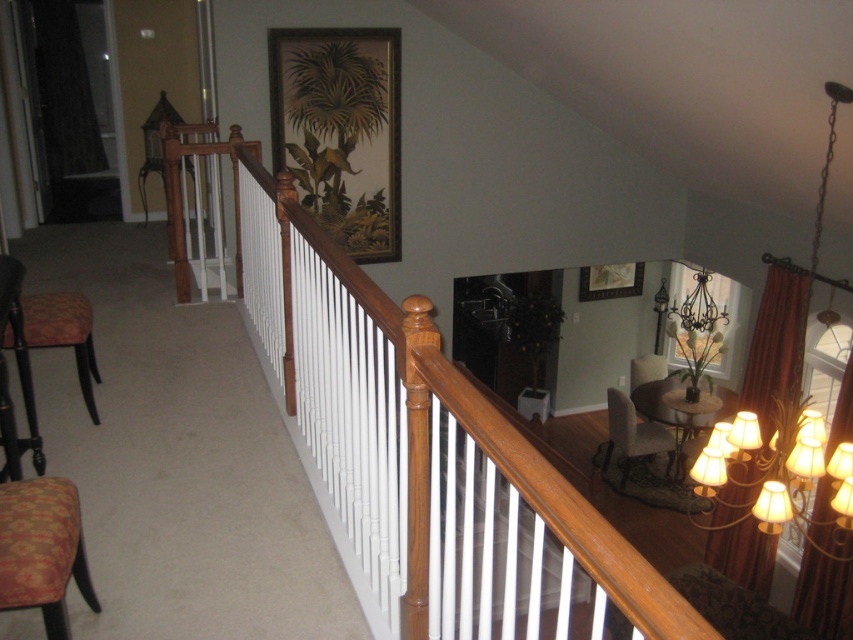
You are standing in the hallway and want to reach the dining room. You see the wooden rail at upper left. Based on its position, which direction should you turn to enter the dining room?

Since the wooden rail at upper left is located at coordinates approximately 0.702 on the x and 0.491 on the y axis, it suggests the dining room is to the right of the staircase area. Therefore, you should turn right to enter the dining room.

You are a painter who needs to hang a large painting that requires a sturdy support. You see the wooden rail at upper left and the velvet beige armchair at lower right. Which object is more suitable for hanging the painting?

The wooden rail at upper left is much taller than the velvet beige armchair at lower right, making it more suitable for hanging the large painting as it can provide a stable and sturdy support.